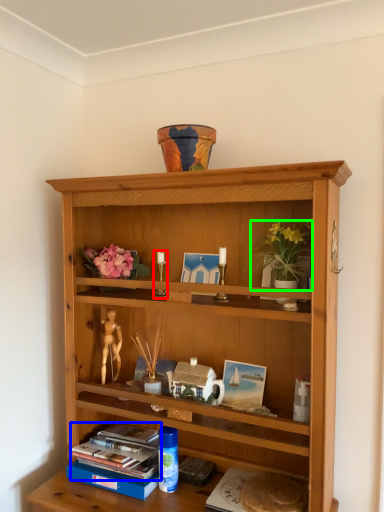
Question: Which is nearer to the candle holder (highlighted by a red box)? book (highlighted by a blue box) or houseplant (highlighted by a green box).

Choices:
 (A) book
 (B) houseplant

Answer: (B)